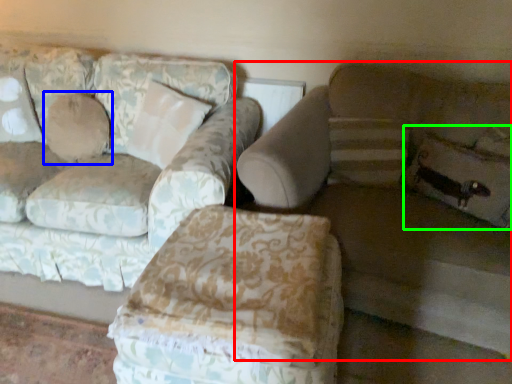
Question: Which object is the farthest from studio couch (highlighted by a red box)? Choose among these: pillow (highlighted by a blue box) or pillow (highlighted by a green box).

Choices:
 (A) pillow
 (B) pillow

Answer: (A)